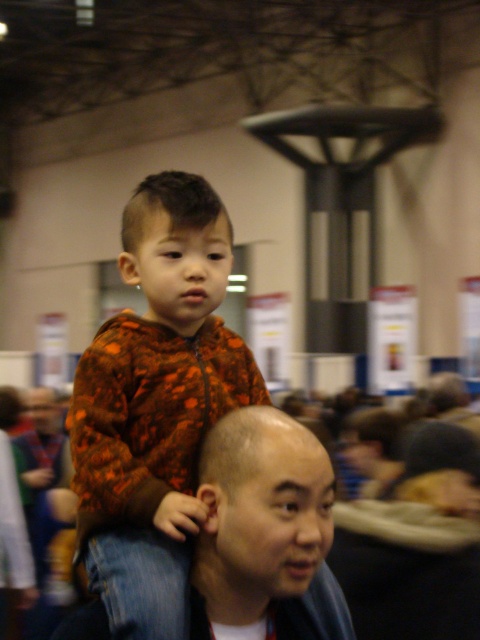
Question: Is orange fleece jacket at upper center thinner than matte black head at upper center?

Choices:
 (A) yes
 (B) no

Answer: (A)

Question: Which of the following is the farthest from the observer?

Choices:
 (A) (210, 522)
 (B) (201, 436)
 (C) (237, 362)

Answer: (C)

Question: Which object is the closest to the orange printed shirt at upper left?

Choices:
 (A) orange printed hoodie at center
 (B) matte black head at upper center
 (C) smooth brown hair at upper center

Answer: (A)

Question: Among these points, which one is farthest from the camera?

Choices:
 (A) (186, 177)
 (B) (451, 372)

Answer: (B)

Question: Can you confirm if orange printed shirt at upper left is wider than orange printed shirt at center?

Choices:
 (A) no
 (B) yes

Answer: (A)

Question: Does orange printed shirt at upper left lie in front of matte black head at upper center?

Choices:
 (A) no
 (B) yes

Answer: (B)